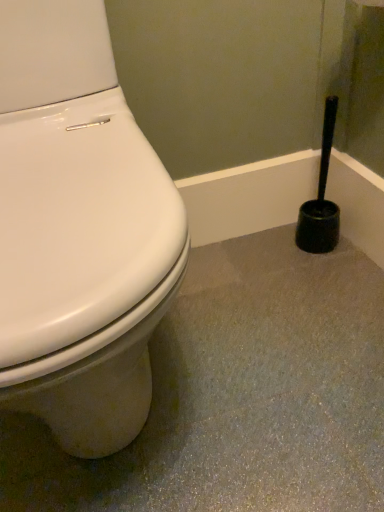
Describe the element at coordinates (321, 198) in the screenshot. I see `black plastic toilet brush at right` at that location.

You are a GUI agent. You are given a task and a screenshot of the screen. Output one action in this format:
    pyautogui.click(x=<x>, y=<y>)
    Task: Click on the black plastic toilet brush at right
    The height and width of the screenshot is (512, 384).
    Given the screenshot: What is the action you would take?
    pyautogui.click(x=321, y=198)

Based on the photo, what is the approximate width of white glossy toilet at left?

61.92 centimeters.

What do you see at coordinates (79, 231) in the screenshot? I see `white glossy toilet at left` at bounding box center [79, 231].

The width and height of the screenshot is (384, 512). Identify the location of white glossy toilet at left. (79, 231).

At what (x,y) coordinates should I click in order to perform the action: click on black plastic toilet brush at right. Please return your answer as a coordinate pair (x, y). Image resolution: width=384 pixels, height=512 pixels. Looking at the image, I should click on (321, 198).

Is white glossy toilet at left at the right side of black plastic toilet brush at right?

No.

Which is in front, white glossy toilet at left or black plastic toilet brush at right?

white glossy toilet at left is more forward.

Which is closer to the camera, (56, 180) or (302, 236)?

Clearly, point (56, 180) is closer to the camera than point (302, 236).

From the image's perspective, is white glossy toilet at left under black plastic toilet brush at right?

Yes.

From a real-world perspective, is white glossy toilet at left positioned above or below black plastic toilet brush at right?

Clearly, from a real-world perspective, white glossy toilet at left is above black plastic toilet brush at right.

Based on the photo, which of these two, white glossy toilet at left or black plastic toilet brush at right, is thinner?

black plastic toilet brush at right is thinner.

Considering the sizes of objects white glossy toilet at left and black plastic toilet brush at right in the image provided, who is shorter, white glossy toilet at left or black plastic toilet brush at right?

black plastic toilet brush at right is shorter.

Is white glossy toilet at left bigger or smaller than black plastic toilet brush at right?

white glossy toilet at left is bigger than black plastic toilet brush at right.

Would you say black plastic toilet brush at right is part of white glossy toilet at left's contents?

No, black plastic toilet brush at right is not surrounded by white glossy toilet at left.

Is white glossy toilet at left beside black plastic toilet brush at right?

white glossy toilet at left is not next to black plastic toilet brush at right, and they're not touching.

Is white glossy toilet at left oriented towards black plastic toilet brush at right?

No.

Where is `toilet below the black plastic toilet brush at right (from the image's perspective)`? Image resolution: width=384 pixels, height=512 pixels. toilet below the black plastic toilet brush at right (from the image's perspective) is located at coordinates click(x=79, y=231).

Looking at this image, between black plastic toilet brush at right and white glossy toilet at left, which one appears on the right side from the viewer's perspective?

black plastic toilet brush at right.

Who is more distant, black plastic toilet brush at right or white glossy toilet at left?

black plastic toilet brush at right is behind.

Considering the positions of point (320, 173) and point (100, 256), is point (320, 173) closer or farther from the camera than point (100, 256)?

Point (320, 173).

From the image's perspective, which one is positioned lower, black plastic toilet brush at right or white glossy toilet at left?

white glossy toilet at left.

From a real-world perspective, between black plastic toilet brush at right and white glossy toilet at left, who is vertically lower?

From a 3D spatial view, black plastic toilet brush at right is below.

Between black plastic toilet brush at right and white glossy toilet at left, which one has larger width?

Wider between the two is white glossy toilet at left.

Is black plastic toilet brush at right taller than white glossy toilet at left?

No, black plastic toilet brush at right is not taller than white glossy toilet at left.

Considering the relative sizes of black plastic toilet brush at right and white glossy toilet at left in the image provided, is black plastic toilet brush at right smaller than white glossy toilet at left?

Indeed, black plastic toilet brush at right has a smaller size compared to white glossy toilet at left.

Is black plastic toilet brush at right inside the boundaries of white glossy toilet at left, or outside?

black plastic toilet brush at right is spatially situated outside white glossy toilet at left.

Is black plastic toilet brush at right far away from white glossy toilet at left?

black plastic toilet brush at right is actually quite close to white glossy toilet at left.

Is black plastic toilet brush at right oriented away from white glossy toilet at left?

No, black plastic toilet brush at right is not facing away from white glossy toilet at left.

Consider the image. Can you tell me how much black plastic toilet brush at right and white glossy toilet at left differ in facing direction?

The angle between the facing direction of black plastic toilet brush at right and the facing direction of white glossy toilet at left is 1.37 degrees.

At what (x,y) coordinates should I click in order to perform the action: click on brush above the white glossy toilet at left (from the image's perspective). Please return your answer as a coordinate pair (x, y). This screenshot has width=384, height=512. Looking at the image, I should click on (321, 198).

This screenshot has height=512, width=384. I want to click on toilet that is below the black plastic toilet brush at right (from the image's perspective), so click(79, 231).

Identify the location of toilet on the left of black plastic toilet brush at right. This screenshot has height=512, width=384. tap(79, 231).